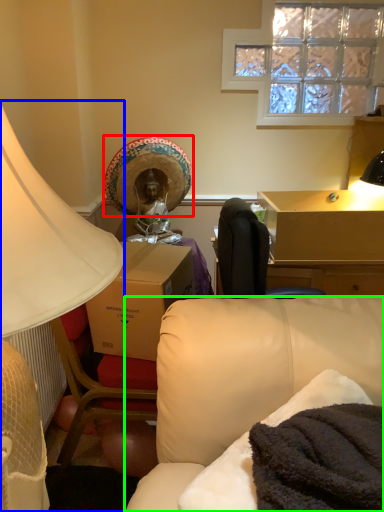
Question: Which object is the closest to the straw hat (highlighted by a red box)? Choose among these: lamp (highlighted by a blue box) or studio couch (highlighted by a green box).

Choices:
 (A) lamp
 (B) studio couch

Answer: (B)